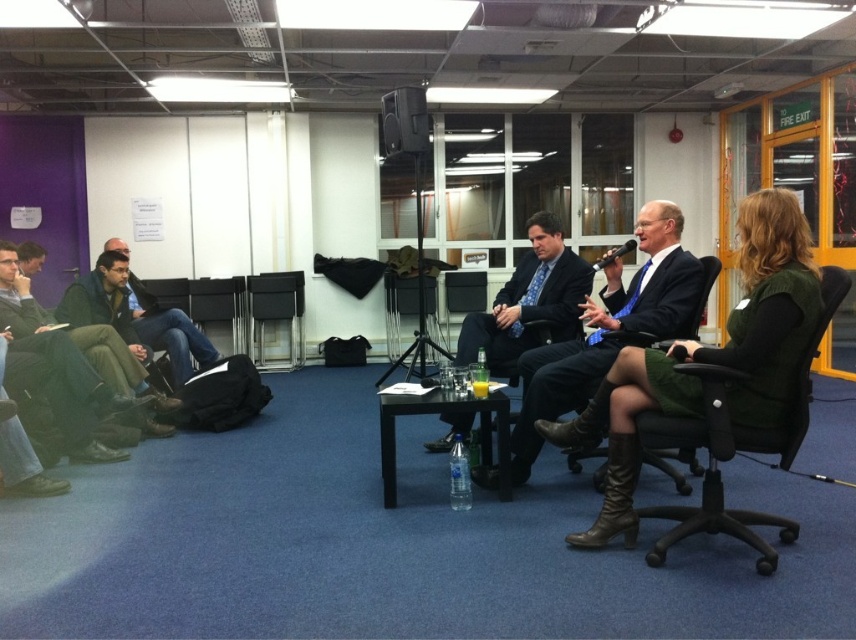
In the conference room scene, there is a black table with a water bottle, glass of orange juice, and papers. Also present are three individuals on the left side of the image. Now, you are standing at point A located at coordinates (706, 358). What object or person is located exactly at this point?

At point A located at coordinates (706, 358), there is a green fabric skirt at center.

You are standing in the conference room and want to move from the point closer to you to the point further away. Which path should you take to go from the point at (409, 97) to the point at (212, 314)?

The point at (409, 97) is closer to the viewer than the point at (212, 314). To move from the closer point to the further one, you should walk towards the direction where the distance increases, following the path from point (409, 97) to point (212, 314).

In the conference room scene, there are two green fabric items present. The first is the green fabric skirt at center and the second is the green fabric swivel chair at center right. Which of these two objects is positioned to the left of the other?

The green fabric skirt at center is positioned to the left of the green fabric swivel chair at center right.